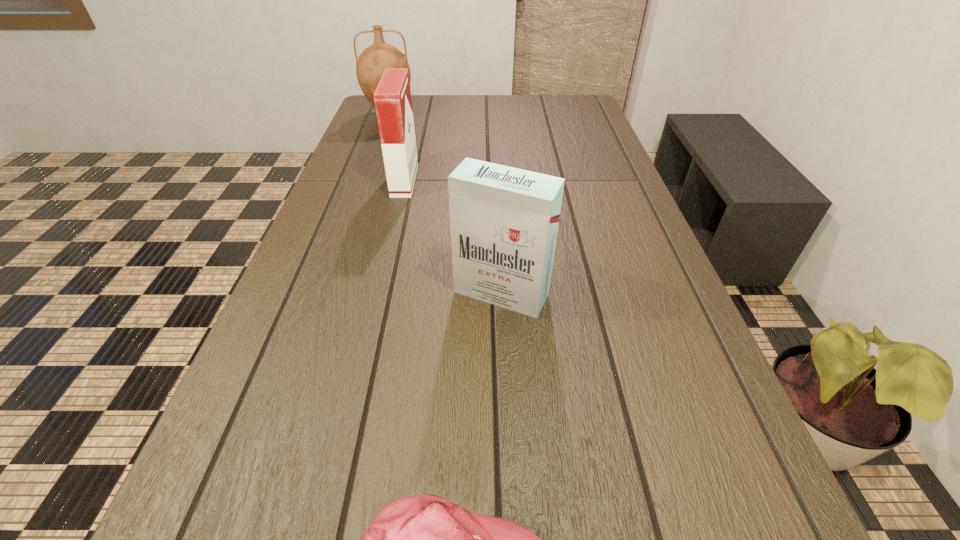
Identify which object is the second closest to the baseball cap. Please provide its 2D coordinates. Your answer should be formatted as a tuple, i.e. [(x, y)], where the tuple contains the x and y coordinates of a point satisfying the conditions above.

[(392, 97)]

This screenshot has height=540, width=960. I want to click on free space that satisfies the following two spatial constraints: 1. on the front-facing side of the right cigarette case; 2. on the right side of the farther cigarette case, so click(x=377, y=293).

At what (x,y) coordinates should I click in order to perform the action: click on vacant space that satisfies the following two spatial constraints: 1. on the front-facing side of the farther cigarette case; 2. on the back side of the right cigarette case. Please return your answer as a coordinate pair (x, y). Looking at the image, I should click on (377, 293).

Locate an element on the screen. The width and height of the screenshot is (960, 540). vacant region that satisfies the following two spatial constraints: 1. on the back side of the second nearest object; 2. on the front-facing side of the second farthest object is located at coordinates (495, 180).

Locate an element on the screen. This screenshot has height=540, width=960. free space that satisfies the following two spatial constraints: 1. on the front side of the nearer cigarette case; 2. on the left side of the farthest object is located at coordinates (324, 293).

The width and height of the screenshot is (960, 540). What are the coordinates of `vacant area in the image that satisfies the following two spatial constraints: 1. on the front side of the farthest object; 2. on the left side of the right cigarette case` in the screenshot? It's located at (324, 293).

You are a GUI agent. You are given a task and a screenshot of the screen. Output one action in this format:
    pyautogui.click(x=<x>, y=<y>)
    Task: Click on the free location that satisfies the following two spatial constraints: 1. on the front-facing side of the farther cigarette case; 2. on the back side of the nearer cigarette case
    
    Given the screenshot: What is the action you would take?
    (377, 293)

The image size is (960, 540). What are the coordinates of `free space that satisfies the following two spatial constraints: 1. on the front-facing side of the left cigarette case; 2. on the right side of the right cigarette case` in the screenshot? It's located at (377, 293).

The width and height of the screenshot is (960, 540). What are the coordinates of `free location that satisfies the following two spatial constraints: 1. on the back side of the third farthest object; 2. on the front-facing side of the left cigarette case` in the screenshot? It's located at (495, 180).